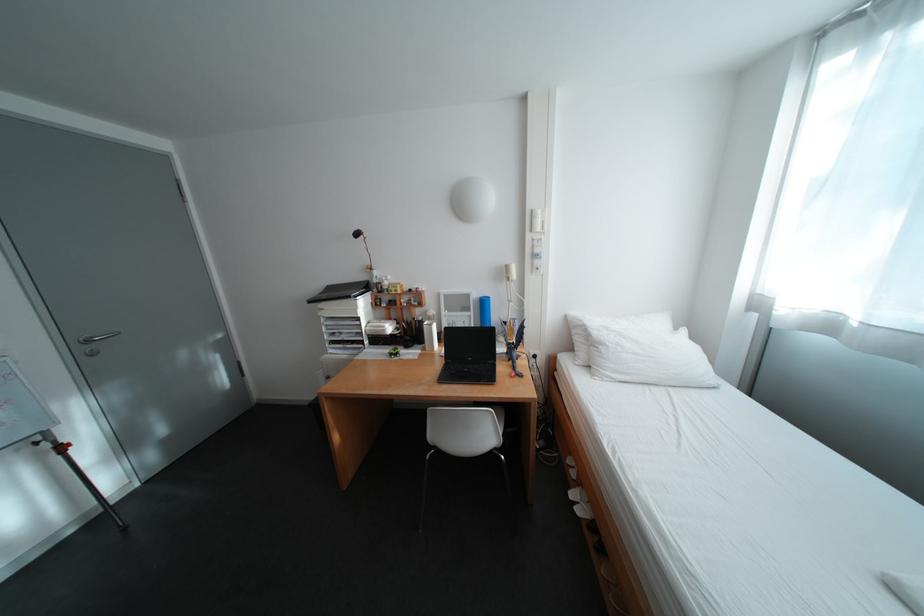
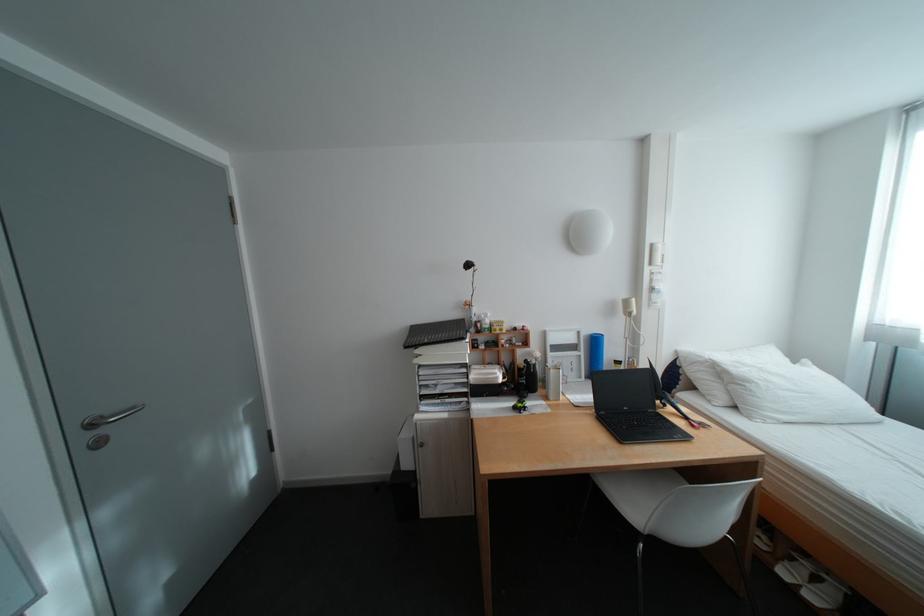
Locate, in the second image, the point that corresponds to point (371, 318) in the first image.

(480, 363)